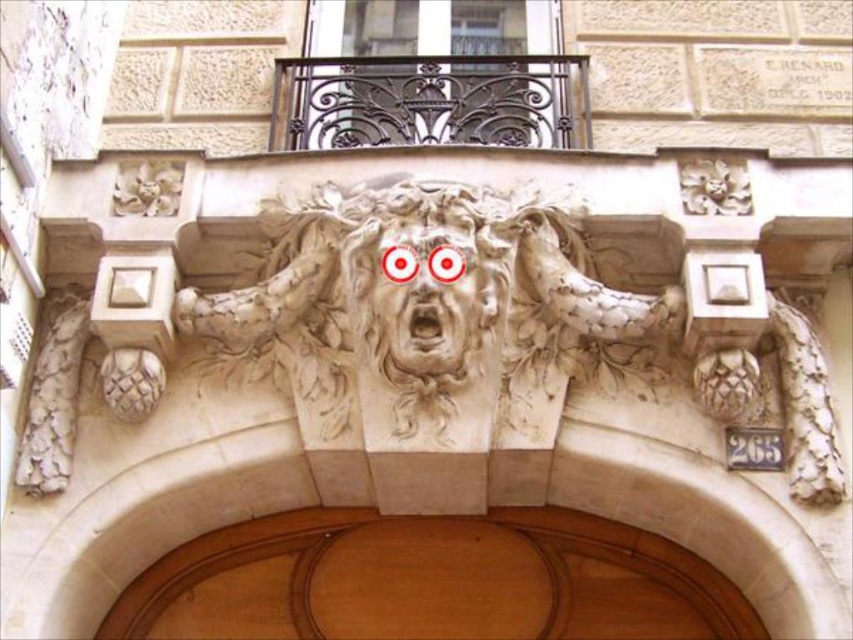
Who is positioned more to the right, white stone lion at center or carved stone face at center?

white stone lion at center

Does point (590, 282) come farther from viewer compared to point (444, 291)?

Yes, point (590, 282) is farther from viewer.

Locate an element on the screen. white stone lion at center is located at coordinates (427, 300).

Is point (621, 618) less distant than point (469, 269)?

No.

Which is behind, point (572, 528) or point (427, 276)?

The point (572, 528) is behind.

Identify the location of wooden door at center. The image size is (853, 640). (x=431, y=580).

Is white stone lion at center taller than wooden door at center?

Yes.

Which is behind, point (351, 307) or point (625, 627)?

The point (625, 627) is more distant.

Between point (535, 221) and point (213, 541), which one is positioned in front?

Point (535, 221) is more forward.

At what (x,y) coordinates should I click in order to perform the action: click on white stone lion at center. Please return your answer as a coordinate pair (x, y). The height and width of the screenshot is (640, 853). Looking at the image, I should click on (427, 300).